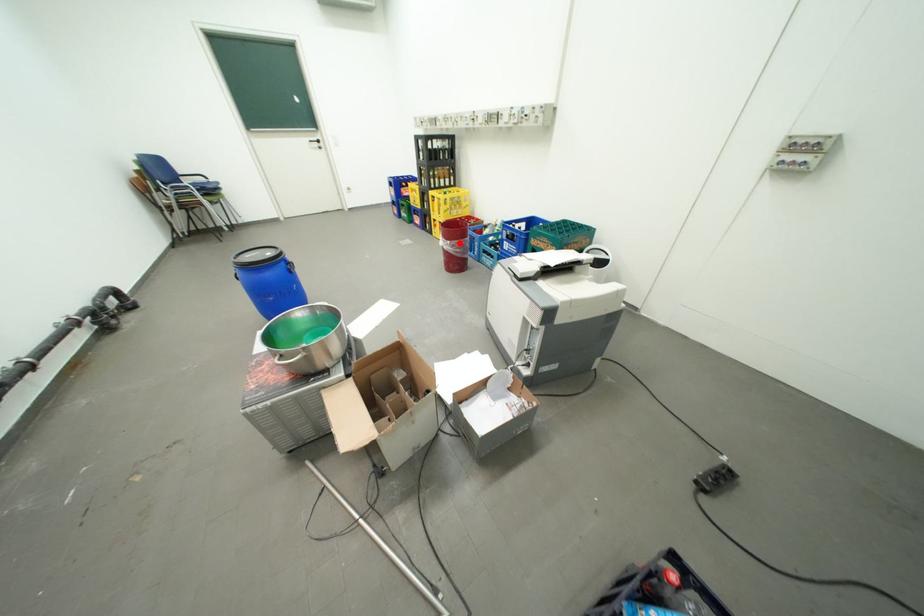
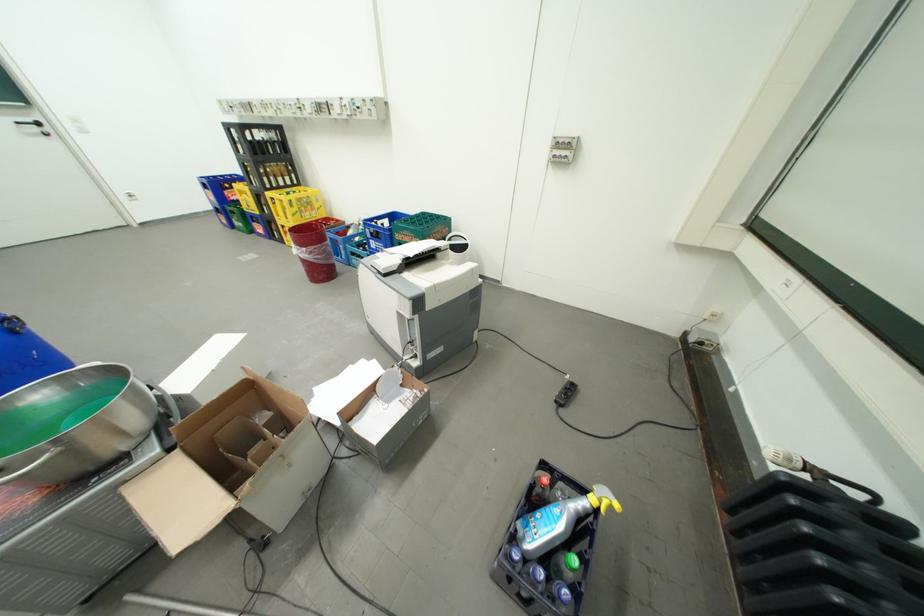
Question: I am providing you with two images of the same scene from different viewpoints. A red point is shown in image1. For the corresponding object point in image2, is it positioned nearer or farther from the camera?

Choices:
 (A) Nearer
 (B) Farther

Answer: (A)